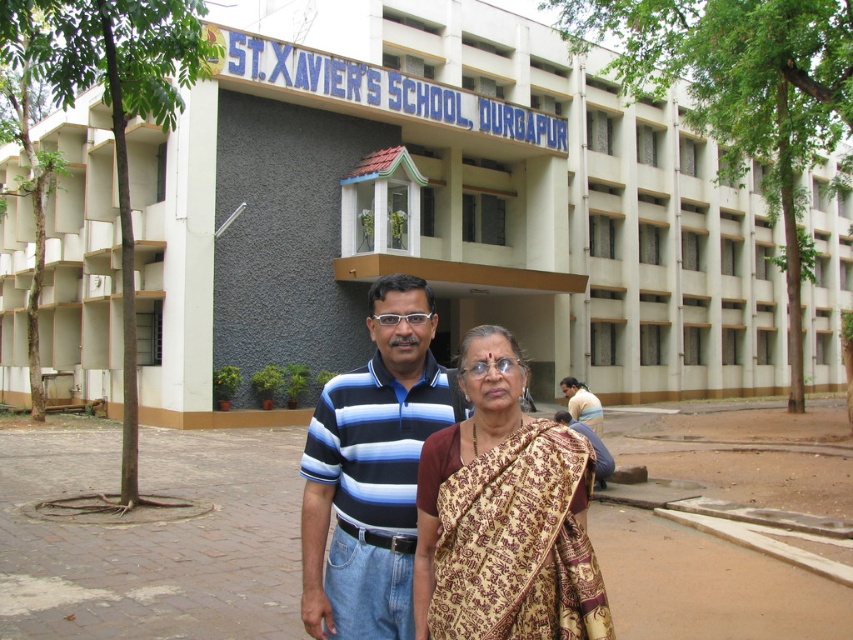
Question: Estimate the real-world distances between objects in this image. Which object is closer to the brown silk saree at center?

Choices:
 (A) striped cotton shirt at center
 (B) gray concrete building at center

Answer: (A)

Question: Observing the image, what is the correct spatial positioning of striped cotton shirt at center in reference to light brown fabric shirt at lower right?

Choices:
 (A) above
 (B) below

Answer: (A)

Question: In this image, where is striped cotton shirt at center located relative to light brown fabric shirt at lower right?

Choices:
 (A) right
 (B) left

Answer: (B)

Question: Which of the following is the closest to the observer?

Choices:
 (A) gray concrete building at center
 (B) light brown fabric shirt at lower right

Answer: (B)

Question: Is brown silk saree at center above light brown fabric shirt at lower right?

Choices:
 (A) yes
 (B) no

Answer: (A)

Question: Considering the real-world distances, which object is closest to the brown silk saree at center?

Choices:
 (A) light brown fabric shirt at lower right
 (B) striped cotton shirt at center

Answer: (B)